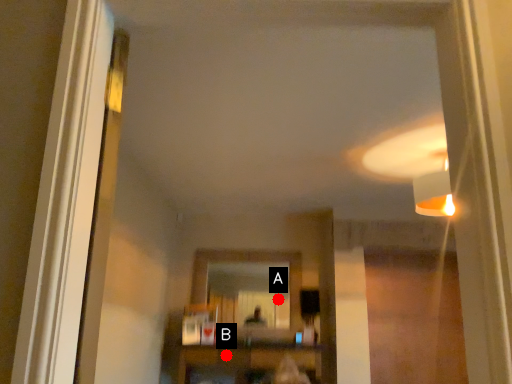
Question: Two points are circled on the image, labeled by A and B beside each circle. Which point is further to the camera?

Choices:
 (A) A is further
 (B) B is further

Answer: (A)